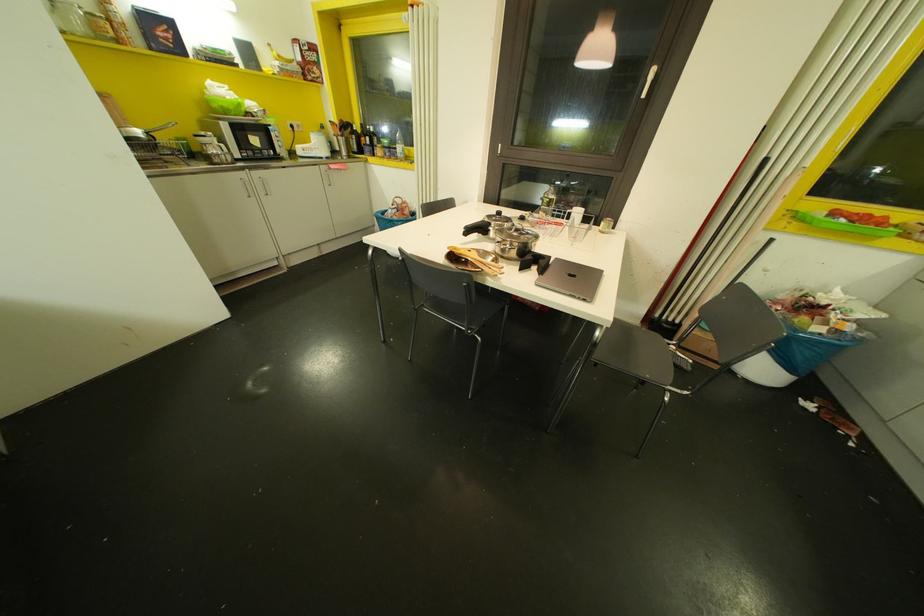
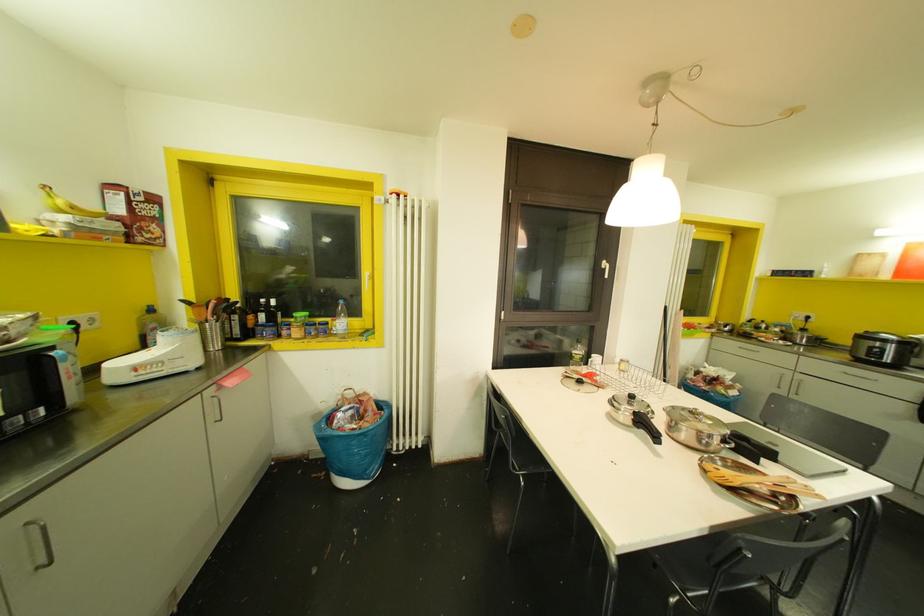
The point at (298, 152) is marked in the first image. Where is the corresponding point in the second image?

(116, 378)